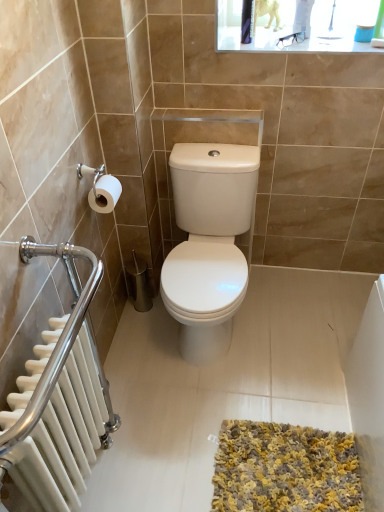
Question: Is white matte toilet paper at left beside yellow-grey shaggy bath mat at lower center?

Choices:
 (A) yes
 (B) no

Answer: (B)

Question: Is white matte toilet paper at left positioned before yellow-grey shaggy bath mat at lower center?

Choices:
 (A) no
 (B) yes

Answer: (A)

Question: From the image's perspective, is white matte toilet paper at left on top of yellow-grey shaggy bath mat at lower center?

Choices:
 (A) yes
 (B) no

Answer: (A)

Question: Considering the relative sizes of white matte toilet paper at left and yellow-grey shaggy bath mat at lower center in the image provided, is white matte toilet paper at left smaller than yellow-grey shaggy bath mat at lower center?

Choices:
 (A) no
 (B) yes

Answer: (B)

Question: Can you confirm if white matte toilet paper at left is positioned to the left of yellow-grey shaggy bath mat at lower center?

Choices:
 (A) no
 (B) yes

Answer: (B)

Question: In terms of height, does white metallic radiator at left look taller or shorter compared to yellow-grey shaggy bath mat at lower center?

Choices:
 (A) short
 (B) tall

Answer: (B)

Question: Is white metallic radiator at left inside the boundaries of yellow-grey shaggy bath mat at lower center, or outside?

Choices:
 (A) outside
 (B) inside

Answer: (A)

Question: Looking at their shapes, would you say white metallic radiator at left is wider or thinner than yellow-grey shaggy bath mat at lower center?

Choices:
 (A) wide
 (B) thin

Answer: (B)

Question: Based on their positions, is white metallic radiator at left located to the left or right of yellow-grey shaggy bath mat at lower center?

Choices:
 (A) left
 (B) right

Answer: (A)

Question: Considering the positions of yellow-grey shaggy bath mat at lower center and white metallic radiator at left in the image, is yellow-grey shaggy bath mat at lower center taller or shorter than white metallic radiator at left?

Choices:
 (A) tall
 (B) short

Answer: (B)

Question: Considering the positions of yellow-grey shaggy bath mat at lower center and white metallic radiator at left in the image, is yellow-grey shaggy bath mat at lower center bigger or smaller than white metallic radiator at left?

Choices:
 (A) small
 (B) big

Answer: (A)

Question: Is yellow-grey shaggy bath mat at lower center wider or thinner than white metallic radiator at left?

Choices:
 (A) wide
 (B) thin

Answer: (A)

Question: Is yellow-grey shaggy bath mat at lower center in front of or behind white metallic radiator at left in the image?

Choices:
 (A) behind
 (B) front

Answer: (A)

Question: From a real-world perspective, is white matte toilet paper at left physically located above or below white metallic radiator at left?

Choices:
 (A) below
 (B) above

Answer: (B)

Question: Considering the relative positions of white matte toilet paper at left and white metallic radiator at left in the image provided, is white matte toilet paper at left to the left or to the right of white metallic radiator at left?

Choices:
 (A) left
 (B) right

Answer: (B)